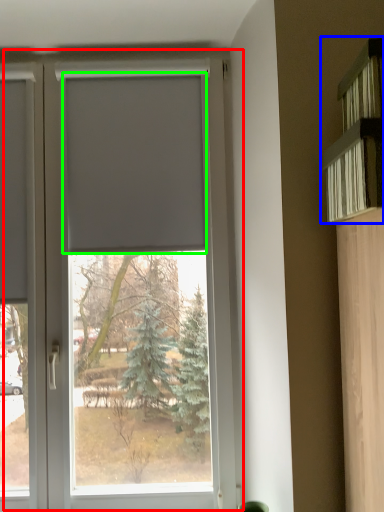
Question: Which is nearer to the window (highlighted by a red box)? shelf (highlighted by a blue box) or blind (highlighted by a green box).

Choices:
 (A) shelf
 (B) blind

Answer: (B)